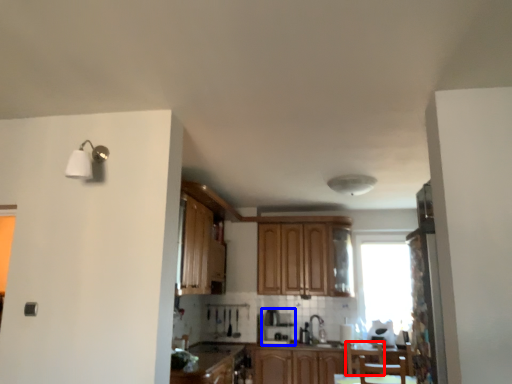
Question: Which of the following is the closest to the observer, armchair (highlighted by a red box) or coffee machine (highlighted by a blue box)?

Choices:
 (A) armchair
 (B) coffee machine

Answer: (A)